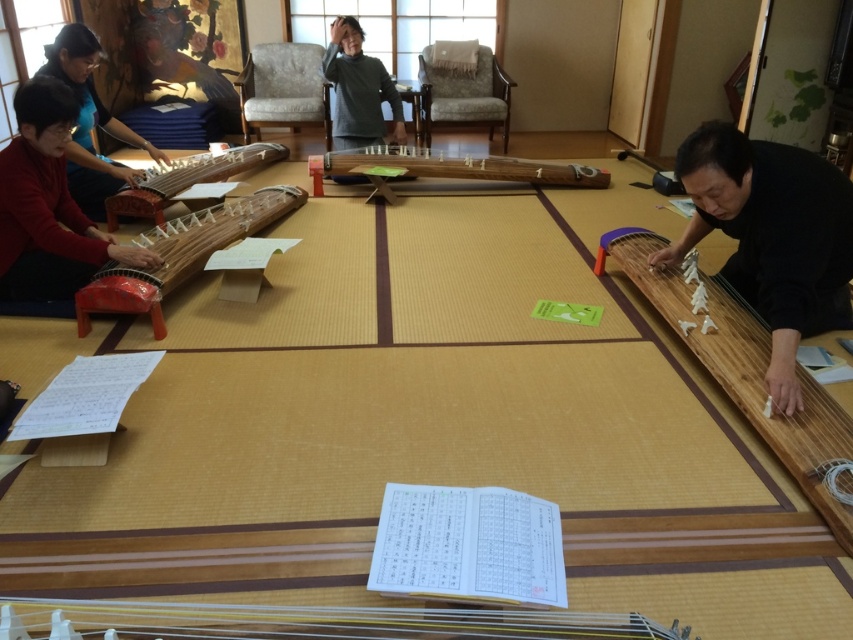
Question: Considering the real-world distances, which object is closest to the wooden harp at right?

Choices:
 (A) transparent plastic strings at lower center
 (B) wooden stringed instrument at left
 (C) black matte guzheng at right
 (D) matte black koto at left

Answer: (C)

Question: Among these objects, which one is farthest from the camera?

Choices:
 (A) wooden stringed instrument at center
 (B) black matte guzheng at right

Answer: (A)

Question: Is matte red wood koto at left further to camera compared to matte black koto at left?

Choices:
 (A) no
 (B) yes

Answer: (A)

Question: Considering the relative positions of wooden harp at right and gray matte sweater at center in the image provided, where is wooden harp at right located with respect to gray matte sweater at center?

Choices:
 (A) below
 (B) above

Answer: (A)

Question: Among these points, which one is nearest to the camera?

Choices:
 (A) 125,173
 (B) 45,216
 (C) 215,241

Answer: (B)

Question: Is wooden harp at right to the right of gray matte sweater at center from the viewer's perspective?

Choices:
 (A) no
 (B) yes

Answer: (B)